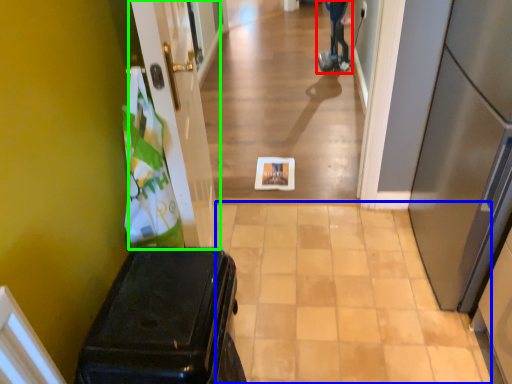
Question: Which object is the closest to the mobility scooter (highlighted by a red box)? Choose among these: path (highlighted by a blue box) or door (highlighted by a green box).

Choices:
 (A) path
 (B) door

Answer: (B)